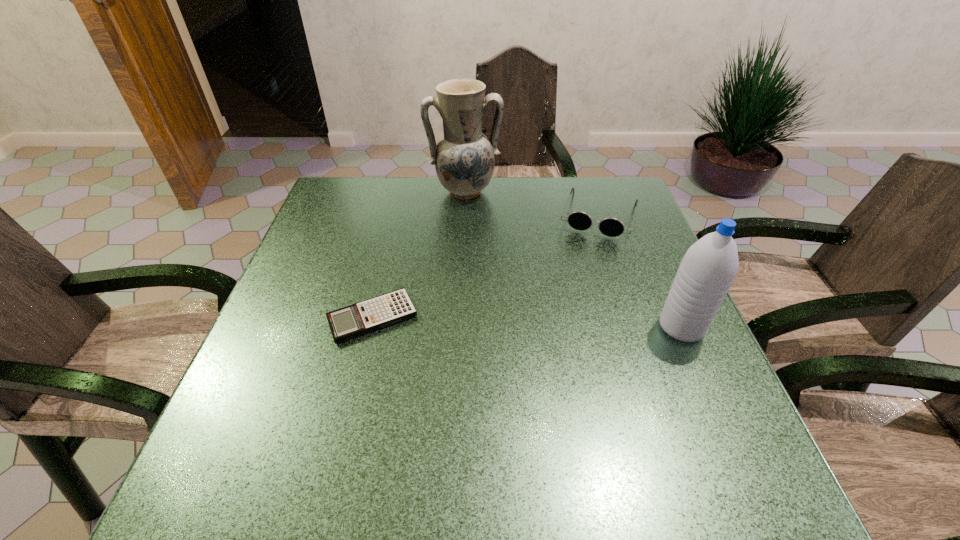
Find the location of a particular element. vacant space positioned 0.180m on the front-facing side of the sunglasses is located at coordinates (579, 285).

Image resolution: width=960 pixels, height=540 pixels. I want to click on vacant region located on the front-facing side of the sunglasses, so click(583, 272).

Identify the location of pottery located in the far edge section of the desktop. (464, 161).

Find the location of a particular element. This screenshot has width=960, height=540. sunglasses positioned at the far edge is located at coordinates (610, 226).

In order to click on object that is positioned at the left edge in this screenshot , I will do `click(379, 312)`.

At what (x,y) coordinates should I click in order to perform the action: click on water bottle present at the right edge. Please return your answer as a coordinate pair (x, y). The width and height of the screenshot is (960, 540). Looking at the image, I should click on (707, 270).

The height and width of the screenshot is (540, 960). I want to click on sunglasses present at the right edge, so click(610, 226).

The width and height of the screenshot is (960, 540). What are the coordinates of `object positioned at the far right corner` in the screenshot? It's located at (610, 226).

Where is `free space at the far edge of the desktop`? The height and width of the screenshot is (540, 960). free space at the far edge of the desktop is located at coordinates (519, 217).

At what (x,y) coordinates should I click in order to perform the action: click on vacant area at the near edge of the desktop. Please return your answer as a coordinate pair (x, y). Looking at the image, I should click on (441, 404).